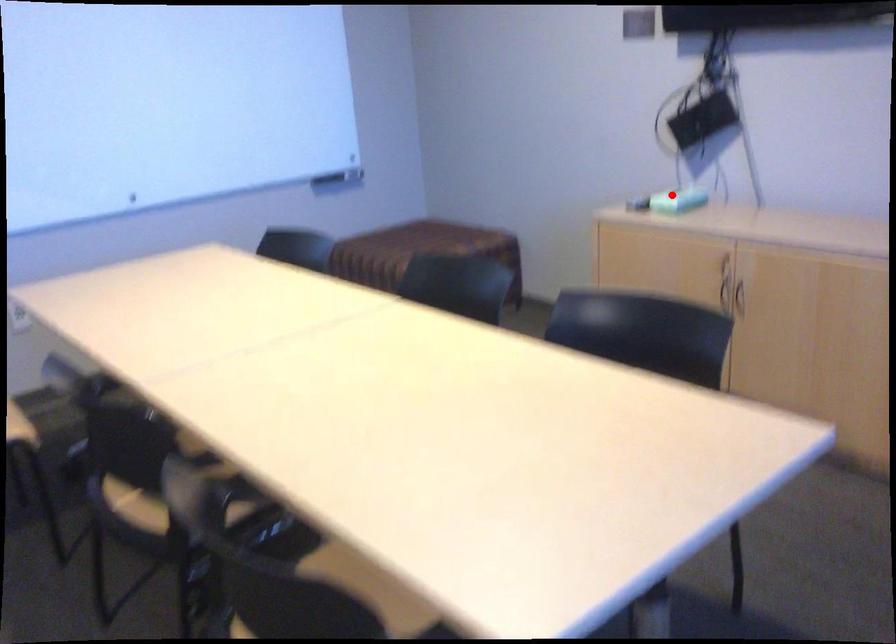
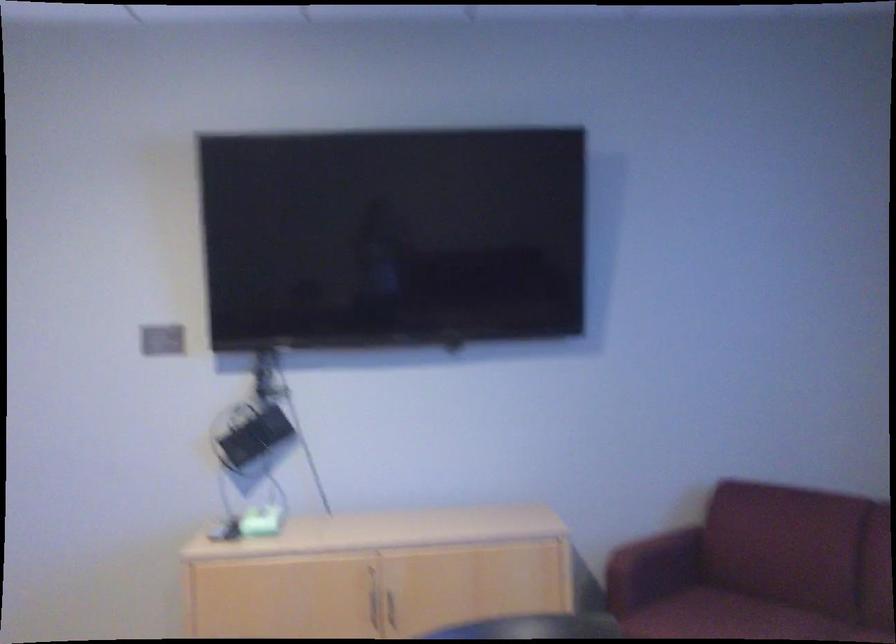
Question: I am providing you with two images of the same scene from different viewpoints. A red point is shown in image1. For the corresponding object point in image2, is it positioned nearer or farther from the camera?

Choices:
 (A) Nearer
 (B) Farther

Answer: (A)